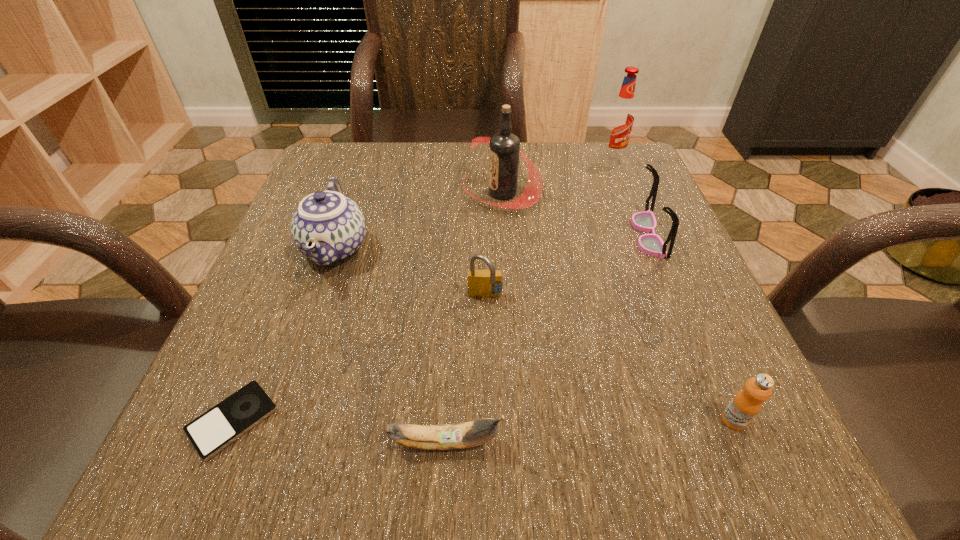
Find the location of a particular element. free spot between the padlock and the iPod is located at coordinates (359, 359).

Locate an element on the screen. This screenshot has width=960, height=540. free space between the farther root beer and the shortest object is located at coordinates (422, 289).

Where is `free spot between the seventh tallest object and the orange juice`? The image size is (960, 540). free spot between the seventh tallest object and the orange juice is located at coordinates pyautogui.click(x=589, y=431).

I want to click on vacant area that lies between the padlock and the chinaware, so click(410, 273).

Locate an element on the screen. The height and width of the screenshot is (540, 960). free spot between the right root beer and the iPod is located at coordinates (422, 289).

Image resolution: width=960 pixels, height=540 pixels. I want to click on free space between the chinaware and the banana, so click(390, 346).

Where is `empty space between the iPod and the spectacles`? The image size is (960, 540). empty space between the iPod and the spectacles is located at coordinates (441, 328).

Point out which object is positioned as the second nearest to the banana. Please provide its 2D coordinates. Your answer should be formatted as a tuple, i.e. [(x, y)], where the tuple contains the x and y coordinates of a point satisfying the conditions above.

[(481, 283)]

Identify which object is located as the fourth nearest to the chinaware. Please provide its 2D coordinates. Your answer should be formatted as a tuple, i.e. [(x, y)], where the tuple contains the x and y coordinates of a point satisfying the conditions above.

[(468, 434)]

The width and height of the screenshot is (960, 540). Identify the location of free space in the image that satisfies the following two spatial constraints: 1. on the front label of the orange juice; 2. on the peel of the second shortest object. (743, 442).